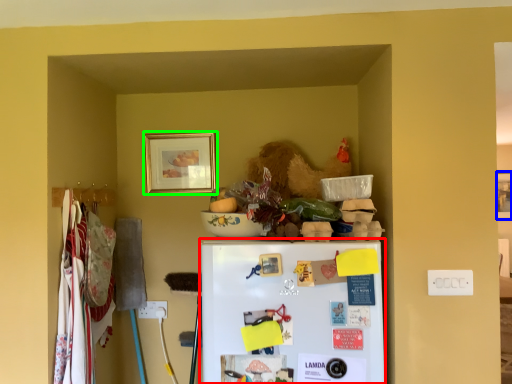
Question: Estimate the real-world distances between objects in this image. Which object is farther from refrigerator (highlighted by a red box), picture frame (highlighted by a blue box) or picture frame (highlighted by a green box)?

Choices:
 (A) picture frame
 (B) picture frame

Answer: (A)